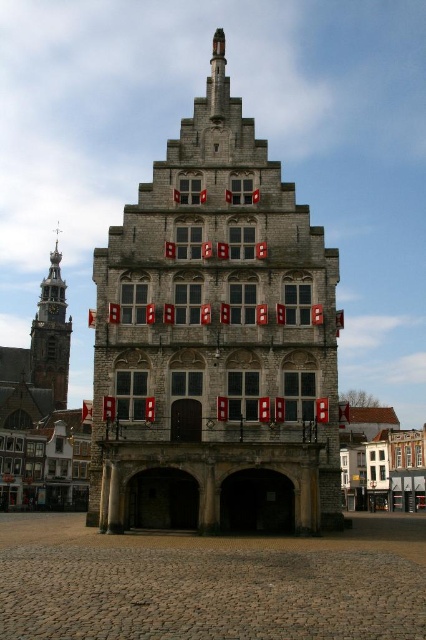
Find the location of a particular element. stone medieval building at center is located at coordinates (215, 342).

Image resolution: width=426 pixels, height=640 pixels. Describe the element at coordinates (215, 342) in the screenshot. I see `stone medieval building at center` at that location.

At what (x,y) coordinates should I click in order to perform the action: click on stone medieval building at center. Please return your answer as a coordinate pair (x, y). This screenshot has width=426, height=640. Looking at the image, I should click on (215, 342).